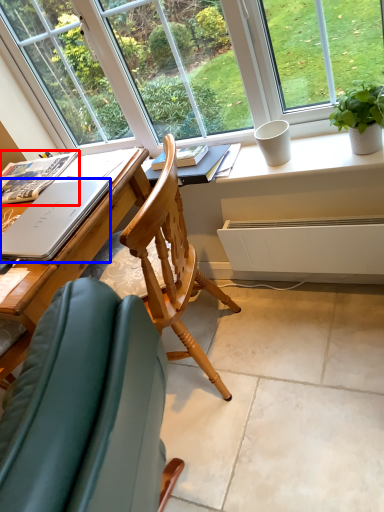
Question: Which of the following is the closest to the observer, book (highlighted by a red box) or laptop (highlighted by a blue box)?

Choices:
 (A) book
 (B) laptop

Answer: (B)